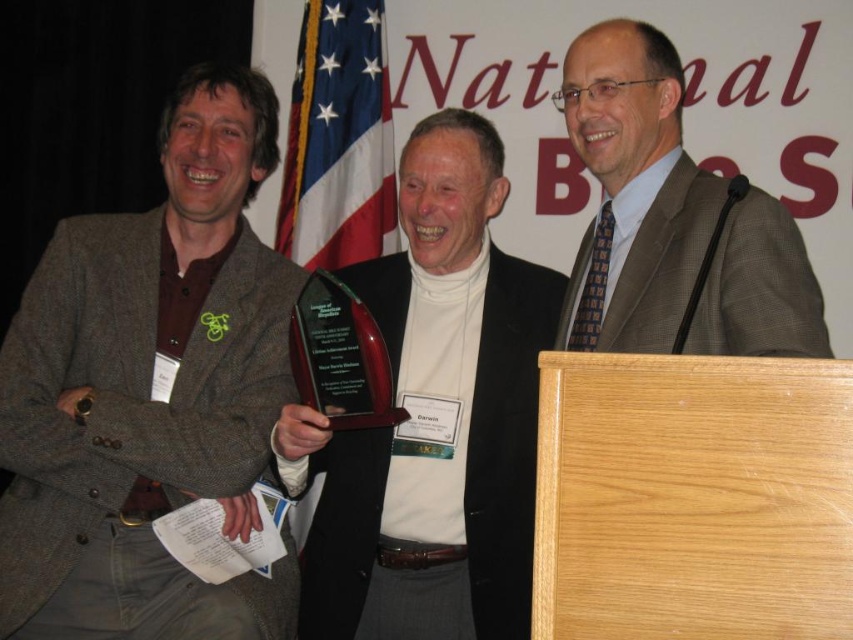
You are a photographer at the event. You need to capture a photo where both the matte brown blazer at center and the shiny dark wood award at center are clearly visible. Given their sizes, which object should you ensure is closer to the camera to avoid it being too small in the photo?

The shiny dark wood award at center is smaller than the matte brown blazer at center. To ensure both are clearly visible, you should position the shiny dark wood award at center closer to the camera so its smaller size is better captured.

You are attending this event and need to identify the person wearing the matte brown blazer at center and the plaid wool suit at center. Based on their positions, which one is standing closer to the left side of the stage?

The matte brown blazer at center is to the left of plaid wool suit at center, so the person wearing the matte brown blazer at center is standing closer to the left side of the stage.

You are a photographer at the event and need to capture a clear photo of both the shiny dark wood award at center and the plaid wool suit at center. Based on their positions, which one is closer to the camera?

The shiny dark wood award at center is closer to the camera because the plaid wool suit at center is behind it.